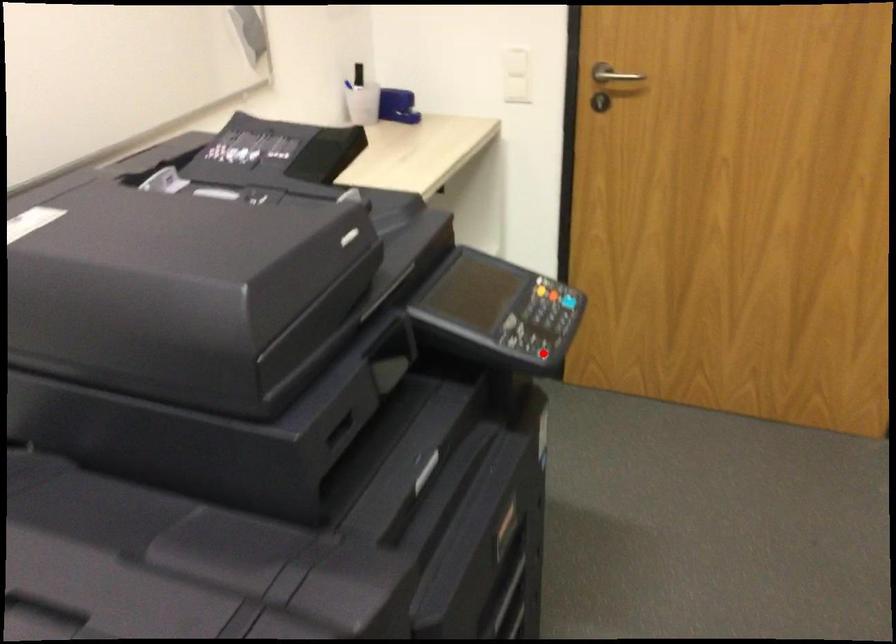
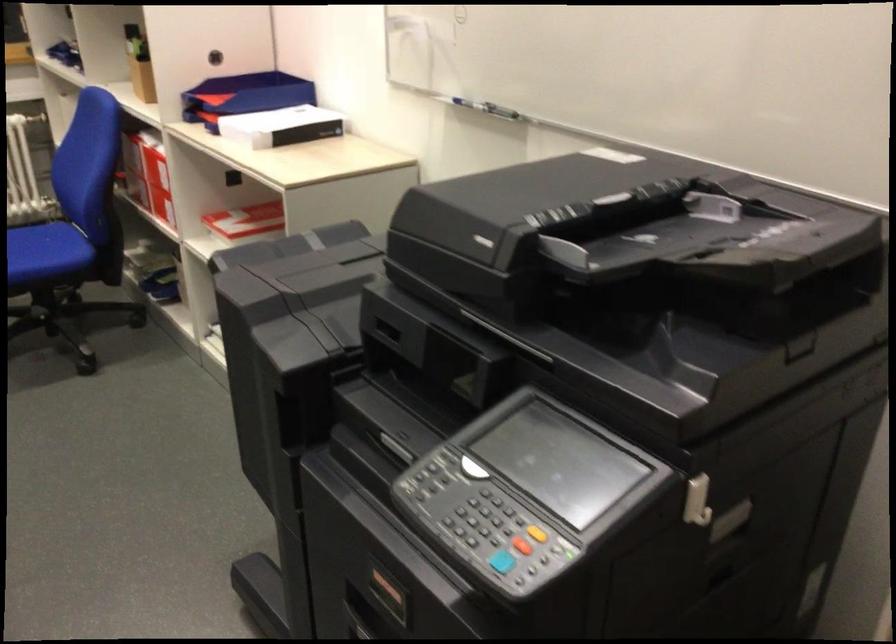
Question: A red point is marked in image1. In image2, is the corresponding 3D point closer to the camera or farther? Reply with the corresponding letter.

Choices:
 (A) The corresponding 3D point is closer.
 (B) The corresponding 3D point is farther.

Answer: (A)